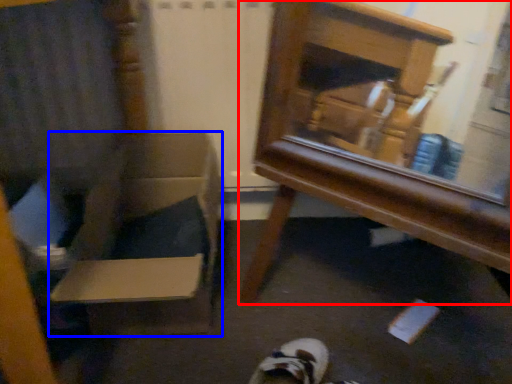
Question: Among these objects, which one is farthest to the camera, furniture (highlighted by a red box) or cardboard box (highlighted by a blue box)?

Choices:
 (A) furniture
 (B) cardboard box

Answer: (B)